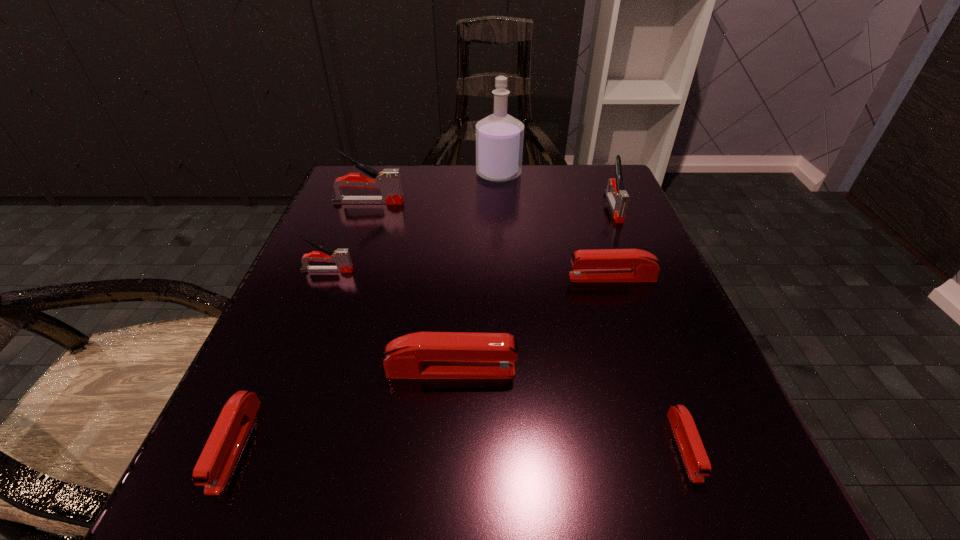
In order to click on free point between the third nearest object and the third smallest red stapler in this screenshot , I will do `click(532, 324)`.

The image size is (960, 540). In order to click on blank region between the shortest object and the third tallest object in this screenshot , I will do `click(649, 326)`.

You are a GUI agent. You are given a task and a screenshot of the screen. Output one action in this format:
    pyautogui.click(x=<x>, y=<y>)
    Task: Click on the empty space between the tallest object and the farthest red stapler
    The width and height of the screenshot is (960, 540).
    Given the screenshot: What is the action you would take?
    pyautogui.click(x=556, y=226)

At what (x,y) coordinates should I click in order to perform the action: click on empty space between the third shortest object and the second tallest object. Please return your answer as a coordinate pair (x, y). The width and height of the screenshot is (960, 540). Looking at the image, I should click on (491, 240).

Identify the location of free area in between the third nearest stapler and the seventh tallest object. This screenshot has width=960, height=540. (343, 407).

In order to click on object that is the fifth closest one to the purple perfume in this screenshot , I will do `click(423, 355)`.

Choose which object is the fifth nearest neighbor to the farthest red stapler. Please provide its 2D coordinates. Your answer should be formatted as a tuple, i.e. [(x, y)], where the tuple contains the x and y coordinates of a point satisfying the conditions above.

[(341, 256)]

Find the location of a particular element. the sixth closest stapler to the shortest stapler is located at coordinates (388, 181).

This screenshot has width=960, height=540. What are the coordinates of `stapler that is the third closest to the sixth tallest stapler` in the screenshot? It's located at (388, 181).

Select which gray stapler appears as the third closest to the purple perfume. Please provide its 2D coordinates. Your answer should be formatted as a tuple, i.e. [(x, y)], where the tuple contains the x and y coordinates of a point satisfying the conditions above.

[(341, 256)]